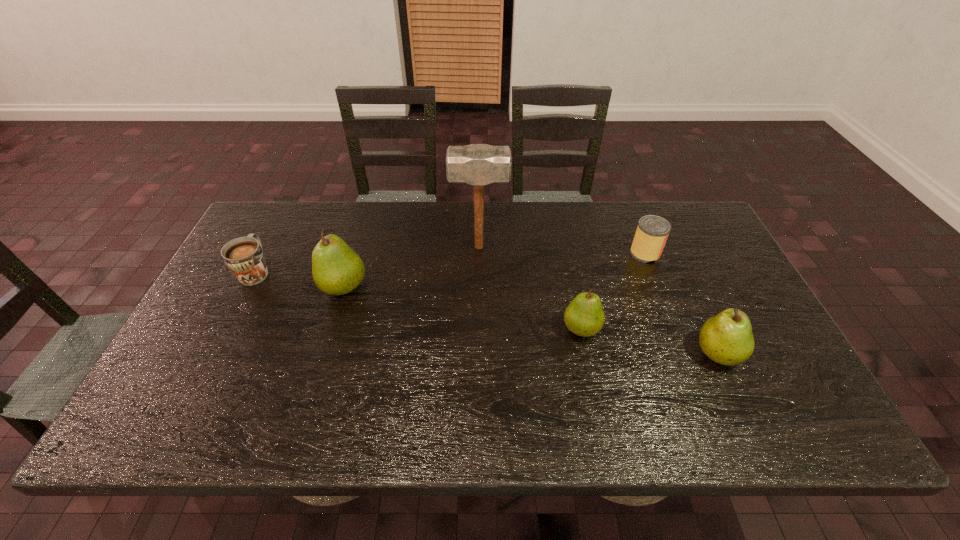
The width and height of the screenshot is (960, 540). In order to click on vacant position for inserting another pear evenly in this screenshot , I will do `click(457, 307)`.